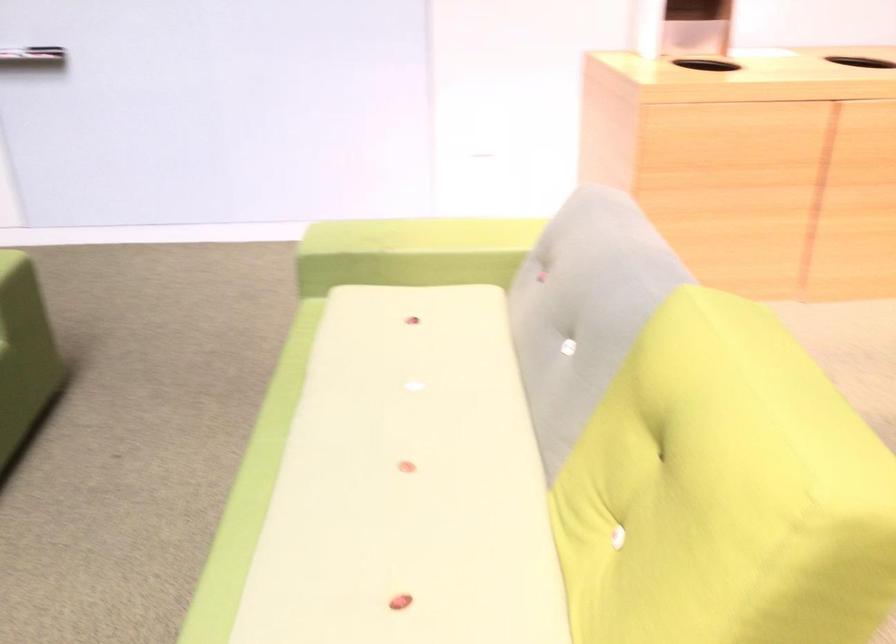
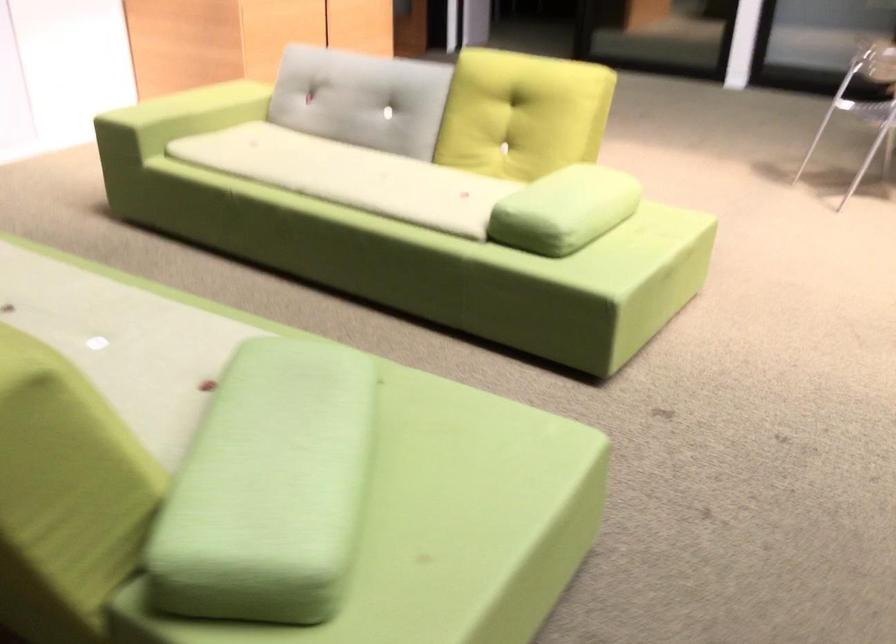
Where in the second image is the point corresponding to [543,324] from the first image?

(362, 99)